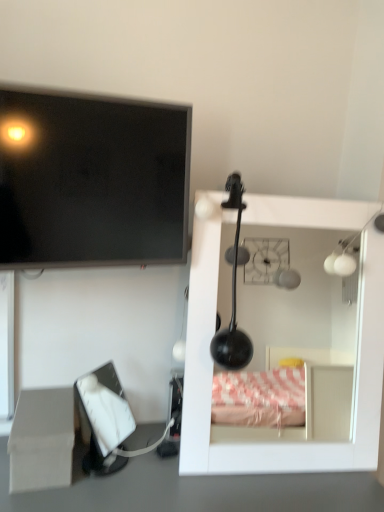
Question: Is white glossy mirror at upper right taller or shorter than matte black screen at upper left?

Choices:
 (A) tall
 (B) short

Answer: (A)

Question: In the image, is white glossy mirror at upper right on the left side or the right side of matte black screen at upper left?

Choices:
 (A) left
 (B) right

Answer: (B)

Question: Estimate the real-world distances between objects in this image. Which object is closer to the white matte tissue box at lower left?

Choices:
 (A) beige cardboard box at lower left
 (B) white glossy mirror at upper right
 (C) matte black screen at upper left

Answer: (A)

Question: Considering the real-world distances, which object is closest to the matte black screen at upper left?

Choices:
 (A) white matte tissue box at lower left
 (B) white glossy mirror at upper right
 (C) beige cardboard box at lower left

Answer: (C)